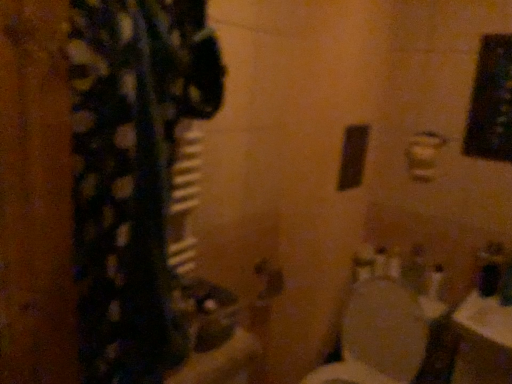
The image size is (512, 384). What do you see at coordinates (269, 280) in the screenshot?
I see `metallic silver door handle at center` at bounding box center [269, 280].

Locate an element on the screen. This screenshot has height=384, width=512. metallic silver door handle at center is located at coordinates (269, 280).

I want to click on white glossy toilet at lower right, so click(378, 336).

What do you see at coordinates (378, 336) in the screenshot? I see `white glossy toilet at lower right` at bounding box center [378, 336].

Find the location of a particular element. The height and width of the screenshot is (384, 512). metallic silver door handle at center is located at coordinates [269, 280].

Is metallic silver door handle at center to the left or to the right of white glossy toilet at lower right in the image?

In the image, metallic silver door handle at center appears on the left side of white glossy toilet at lower right.

In the scene shown: Which object is further away from the camera taking this photo, metallic silver door handle at center or white glossy toilet at lower right?

metallic silver door handle at center is behind.

Which is further, (x=283, y=286) or (x=425, y=342)?

The point (x=283, y=286) is more distant.

From the image's perspective, is metallic silver door handle at center under white glossy toilet at lower right?

No, from the image's perspective, metallic silver door handle at center is not beneath white glossy toilet at lower right.

Consider the image. From a real-world perspective, is metallic silver door handle at center physically above white glossy toilet at lower right?

Indeed, from a real-world perspective, metallic silver door handle at center stands above white glossy toilet at lower right.

Can you confirm if metallic silver door handle at center is thinner than white glossy toilet at lower right?

Correct, the width of metallic silver door handle at center is less than that of white glossy toilet at lower right.

Who is shorter, metallic silver door handle at center or white glossy toilet at lower right?

metallic silver door handle at center is shorter.

Looking at the image, does metallic silver door handle at center seem bigger or smaller compared to white glossy toilet at lower right?

Clearly, metallic silver door handle at center is smaller in size than white glossy toilet at lower right.

Can we say metallic silver door handle at center lies outside white glossy toilet at lower right?

metallic silver door handle at center lies outside white glossy toilet at lower right's area.

Are metallic silver door handle at center and white glossy toilet at lower right beside each other?

No, metallic silver door handle at center is not touching white glossy toilet at lower right.

Is metallic silver door handle at center oriented away from white glossy toilet at lower right?

No, metallic silver door handle at center's orientation is not away from white glossy toilet at lower right.

The width and height of the screenshot is (512, 384). I want to click on toilet in front of the metallic silver door handle at center, so click(x=378, y=336).

Which object is positioned more to the left, white glossy toilet at lower right or metallic silver door handle at center?

metallic silver door handle at center.

Is white glossy toilet at lower right further to the viewer compared to metallic silver door handle at center?

No.

Is point (358, 344) positioned before point (264, 277)?

No, (358, 344) is behind (264, 277).

From the image's perspective, does white glossy toilet at lower right appear lower than metallic silver door handle at center?

Yes.

From a real-world perspective, is white glossy toilet at lower right below metallic silver door handle at center?

Yes, from a real-world perspective, white glossy toilet at lower right is beneath metallic silver door handle at center.

Which object is thinner, white glossy toilet at lower right or metallic silver door handle at center?

metallic silver door handle at center is thinner.

Can you confirm if white glossy toilet at lower right is shorter than metallic silver door handle at center?

No, white glossy toilet at lower right is not shorter than metallic silver door handle at center.

Between white glossy toilet at lower right and metallic silver door handle at center, which one has larger size?

white glossy toilet at lower right.

Is white glossy toilet at lower right completely or partially outside of metallic silver door handle at center?

Absolutely, white glossy toilet at lower right is external to metallic silver door handle at center.

Would you say white glossy toilet at lower right is a long distance from metallic silver door handle at center?

They are positioned close to each other.

Is metallic silver door handle at center at the back of white glossy toilet at lower right?

No, white glossy toilet at lower right is not facing away from metallic silver door handle at center.

Can you tell me how much white glossy toilet at lower right and metallic silver door handle at center differ in facing direction?

The facing directions of white glossy toilet at lower right and metallic silver door handle at center are 90.5 degrees apart.

How distant is white glossy toilet at lower right from metallic silver door handle at center?

They are 17.62 inches apart.

Locate an element on the screen. This screenshot has width=512, height=384. door handle on the left of white glossy toilet at lower right is located at coordinates (269, 280).

Find the location of a particular element. The height and width of the screenshot is (384, 512). door handle behind the white glossy toilet at lower right is located at coordinates click(269, 280).

Identify the location of toilet lying below the metallic silver door handle at center (from the image's perspective). (378, 336).